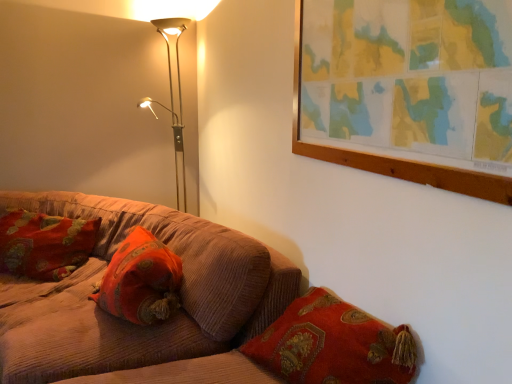
Image resolution: width=512 pixels, height=384 pixels. Describe the element at coordinates (140, 280) in the screenshot. I see `velvet orange pillow at center, the first pillow in the right-to-left sequence` at that location.

What is the approximate height of velvet orange pillow at center, arranged as the first pillow when viewed from the front?

velvet orange pillow at center, arranged as the first pillow when viewed from the front, is 12.28 inches tall.

Locate an element on the screen. This screenshot has height=384, width=512. corduroy couch at lower left is located at coordinates (129, 322).

Where is `velvet cushion at left, arranged as the 1th pillow when viewed from the back`? The image size is (512, 384). velvet cushion at left, arranged as the 1th pillow when viewed from the back is located at coordinates (45, 244).

In order to click on velvet orange pillow at center, the first pillow in the right-to-left sequence in this screenshot , I will do `click(140, 280)`.

Could velvet orange pillow at center, marked as the second pillow in a left-to-right arrangement, be considered to be inside metallic floor lamp at upper left?

That's incorrect, velvet orange pillow at center, marked as the second pillow in a left-to-right arrangement, is not inside metallic floor lamp at upper left.

From a real-world perspective, is metallic floor lamp at upper left on velvet orange pillow at center, the first pillow in the right-to-left sequence?

Yes.

From their relative heights in the image, would you say metallic floor lamp at upper left is taller or shorter than velvet orange pillow at center, which is the 2th pillow in back-to-front order?

In the image, metallic floor lamp at upper left appears to be taller than velvet orange pillow at center, which is the 2th pillow in back-to-front order.

Does metallic floor lamp at upper left have a greater width compared to velvet orange pillow at center, marked as the second pillow in a left-to-right arrangement?

Correct, the width of metallic floor lamp at upper left exceeds that of velvet orange pillow at center, marked as the second pillow in a left-to-right arrangement.

Considering the relative sizes of velvet cushion at left, arranged as the second pillow when viewed from the right, and corduroy couch at lower left in the image provided, is velvet cushion at left, arranged as the second pillow when viewed from the right, wider than corduroy couch at lower left?

Incorrect, the width of velvet cushion at left, arranged as the second pillow when viewed from the right, does not surpass that of corduroy couch at lower left.

Is velvet cushion at left, placed as the 1th pillow when sorted from left to right, in front of corduroy couch at lower left?

No, the depth of velvet cushion at left, placed as the 1th pillow when sorted from left to right, is greater than that of corduroy couch at lower left.

How far apart are velvet cushion at left, placed as the second pillow when sorted from front to back, and corduroy couch at lower left?

12.89 inches.

From the image's perspective, between velvet cushion at left, placed as the 1th pillow when sorted from left to right, and corduroy couch at lower left, who is located below?

corduroy couch at lower left.

Which is more distant, (125, 341) or (15, 242)?

The point (15, 242) is behind.

What's the angular difference between corduroy couch at lower left and velvet cushion at left, placed as the 1th pillow when sorted from left to right,'s facing directions?

They differ by 32.5 degrees in their facing directions.

Is corduroy couch at lower left placed right next to velvet cushion at left, placed as the 1th pillow when sorted from left to right?

No, corduroy couch at lower left is not in contact with velvet cushion at left, placed as the 1th pillow when sorted from left to right.

Between corduroy couch at lower left and velvet cushion at left, arranged as the second pillow when viewed from the right, which one has smaller width?

Thinner between the two is velvet cushion at left, arranged as the second pillow when viewed from the right.

Is velvet orange pillow at center, which is the 2th pillow in back-to-front order, inside the boundaries of corduroy couch at lower left, or outside?

velvet orange pillow at center, which is the 2th pillow in back-to-front order, is enclosed within corduroy couch at lower left.

Between velvet orange pillow at center, arranged as the first pillow when viewed from the front, and corduroy couch at lower left, which one has less height?

velvet orange pillow at center, arranged as the first pillow when viewed from the front.

From a real-world perspective, which is physically above, velvet orange pillow at center, arranged as the first pillow when viewed from the front, or corduroy couch at lower left?

velvet orange pillow at center, arranged as the first pillow when viewed from the front, is physically above.

Is point (148, 273) less distant than point (223, 351)?

No, (148, 273) is behind (223, 351).

Does point (159, 300) lie behind point (176, 42)?

No, (159, 300) is closer to viewer.

In terms of width, does velvet orange pillow at center, arranged as the first pillow when viewed from the front, look wider or thinner when compared to metallic floor lamp at upper left?

velvet orange pillow at center, arranged as the first pillow when viewed from the front, is thinner than metallic floor lamp at upper left.

From the image's perspective, is velvet orange pillow at center, the first pillow in the right-to-left sequence, on top of metallic floor lamp at upper left?

No.

From a real-world perspective, relative to metallic floor lamp at upper left, is velvet orange pillow at center, marked as the second pillow in a left-to-right arrangement, vertically above or below?

Clearly, from a real-world perspective, velvet orange pillow at center, marked as the second pillow in a left-to-right arrangement, is below metallic floor lamp at upper left.

Based on the photo, from a real-world perspective, who is located higher, corduroy couch at lower left or metallic floor lamp at upper left?

metallic floor lamp at upper left.

Would you say metallic floor lamp at upper left is part of corduroy couch at lower left's contents?

No, metallic floor lamp at upper left is not inside corduroy couch at lower left.

Consider the image. Could you tell me if corduroy couch at lower left is turned towards metallic floor lamp at upper left?

No, corduroy couch at lower left is not oriented towards metallic floor lamp at upper left.

How many degrees apart are the facing directions of corduroy couch at lower left and metallic floor lamp at upper left?

The angle between the facing direction of corduroy couch at lower left and the facing direction of metallic floor lamp at upper left is 0.734 degrees.

Considering the points (117, 253) and (4, 243), which point is in front, point (117, 253) or point (4, 243)?

Positioned in front is point (117, 253).

Is velvet orange pillow at center, arranged as the first pillow when viewed from the front, positioned behind velvet cushion at left, arranged as the 1th pillow when viewed from the back?

No.

Can you tell me how much velvet orange pillow at center, marked as the second pillow in a left-to-right arrangement, and velvet cushion at left, placed as the second pillow when sorted from front to back, differ in facing direction?

The angle between the facing direction of velvet orange pillow at center, marked as the second pillow in a left-to-right arrangement, and the facing direction of velvet cushion at left, placed as the second pillow when sorted from front to back, is 40.8 degrees.

Where is `pillow below the velvet cushion at left, placed as the 1th pillow when sorted from left to right (from a real-world perspective)`? pillow below the velvet cushion at left, placed as the 1th pillow when sorted from left to right (from a real-world perspective) is located at coordinates (140, 280).

Where is `lamp above the velvet orange pillow at center, the first pillow in the right-to-left sequence (from a real-world perspective)`? The image size is (512, 384). lamp above the velvet orange pillow at center, the first pillow in the right-to-left sequence (from a real-world perspective) is located at coordinates (170, 62).

Find the location of a particular element. The height and width of the screenshot is (384, 512). studio couch in front of the velvet cushion at left, arranged as the 1th pillow when viewed from the back is located at coordinates (129, 322).

From the image, which object appears to be farther from metallic floor lamp at upper left, corduroy couch at lower left or velvet orange pillow at center, marked as the second pillow in a left-to-right arrangement?

velvet orange pillow at center, marked as the second pillow in a left-to-right arrangement, lies further to metallic floor lamp at upper left than the other object.

From the picture: Looking at the image, which one is located closer to velvet orange pillow at center, the first pillow in the right-to-left sequence, velvet cushion at left, arranged as the 1th pillow when viewed from the back, or metallic floor lamp at upper left?

Based on the image, velvet cushion at left, arranged as the 1th pillow when viewed from the back, appears to be nearer to velvet orange pillow at center, the first pillow in the right-to-left sequence.

Based on their spatial positions, is metallic floor lamp at upper left or corduroy couch at lower left further from velvet orange pillow at center, arranged as the first pillow when viewed from the front?

metallic floor lamp at upper left.

Which object lies further to the anchor point velvet orange pillow at center, marked as the second pillow in a left-to-right arrangement, metallic floor lamp at upper left or velvet cushion at left, placed as the 1th pillow when sorted from left to right?

The object further to velvet orange pillow at center, marked as the second pillow in a left-to-right arrangement, is metallic floor lamp at upper left.

When comparing their distances from corduroy couch at lower left, does metallic floor lamp at upper left or velvet cushion at left, arranged as the 1th pillow when viewed from the back, seem closer?

Based on the image, velvet cushion at left, arranged as the 1th pillow when viewed from the back, appears to be nearer to corduroy couch at lower left.

From the image, which object appears to be farther from corduroy couch at lower left, velvet cushion at left, placed as the second pillow when sorted from front to back, or velvet orange pillow at center, marked as the second pillow in a left-to-right arrangement?

velvet cushion at left, placed as the second pillow when sorted from front to back.

Which object lies further to the anchor point velvet cushion at left, arranged as the 1th pillow when viewed from the back, velvet orange pillow at center, marked as the second pillow in a left-to-right arrangement, or corduroy couch at lower left?

velvet orange pillow at center, marked as the second pillow in a left-to-right arrangement.

Based on their spatial positions, is velvet orange pillow at center, which is the 2th pillow in back-to-front order, or velvet cushion at left, placed as the second pillow when sorted from front to back, closer to metallic floor lamp at upper left?

The object closer to metallic floor lamp at upper left is velvet cushion at left, placed as the second pillow when sorted from front to back.

The image size is (512, 384). What are the coordinates of `pillow between metallic floor lamp at upper left and velvet orange pillow at center, which is the 2th pillow in back-to-front order, from top to bottom` in the screenshot? It's located at (45, 244).

Find the location of a particular element. This screenshot has height=384, width=512. pillow between corduroy couch at lower left and velvet cushion at left, placed as the second pillow when sorted from front to back, along the z-axis is located at coordinates (140, 280).